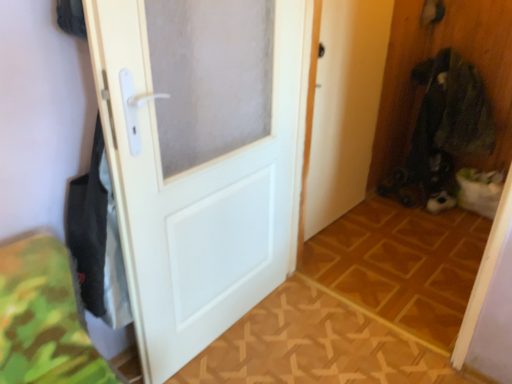
Question: Is the depth of wooden parquet floor at center, the 2th tile in the back-to-front sequence, greater than that of wooden floor at center, which appears as the first tile when viewed from the back?

Choices:
 (A) yes
 (B) no

Answer: (B)

Question: Considering the relative positions of wooden parquet floor at center, the 2th tile in the back-to-front sequence, and wooden floor at center, which ranks as the second tile in front-to-back order, in the image provided, is wooden parquet floor at center, the 2th tile in the back-to-front sequence, to the right of wooden floor at center, which ranks as the second tile in front-to-back order, from the viewer's perspective?

Choices:
 (A) no
 (B) yes

Answer: (A)

Question: Is wooden parquet floor at center, the 2th tile in the back-to-front sequence, located outside wooden floor at center, which ranks as the second tile in front-to-back order?

Choices:
 (A) no
 (B) yes

Answer: (B)

Question: Considering the relative sizes of wooden parquet floor at center, which is counted as the first tile, starting from the front, and wooden floor at center, which ranks as the second tile in front-to-back order, in the image provided, is wooden parquet floor at center, which is counted as the first tile, starting from the front, shorter than wooden floor at center, which ranks as the second tile in front-to-back order,?

Choices:
 (A) no
 (B) yes

Answer: (B)

Question: Is wooden parquet floor at center, which is counted as the first tile, starting from the front, turned away from wooden floor at center, which ranks as the second tile in front-to-back order?

Choices:
 (A) yes
 (B) no

Answer: (B)

Question: Is wooden parquet floor at center, the 2th tile in the back-to-front sequence, facing towards wooden floor at center, which ranks as the second tile in front-to-back order?

Choices:
 (A) no
 (B) yes

Answer: (B)

Question: Is white matte door at center beside dark green fabric at right?

Choices:
 (A) yes
 (B) no

Answer: (B)

Question: From a real-world perspective, is white matte door at center physically above dark green fabric at right?

Choices:
 (A) yes
 (B) no

Answer: (A)

Question: Does white matte door at center have a larger size compared to dark green fabric at right?

Choices:
 (A) yes
 (B) no

Answer: (B)

Question: Considering the relative sizes of white matte door at center and dark green fabric at right in the image provided, is white matte door at center shorter than dark green fabric at right?

Choices:
 (A) yes
 (B) no

Answer: (B)

Question: From a real-world perspective, is white matte door at center physically below dark green fabric at right?

Choices:
 (A) yes
 (B) no

Answer: (B)

Question: Is white matte door at center oriented towards dark green fabric at right?

Choices:
 (A) no
 (B) yes

Answer: (A)

Question: Does dark green fabric at right have a larger size compared to white matte door at center?

Choices:
 (A) no
 (B) yes

Answer: (B)